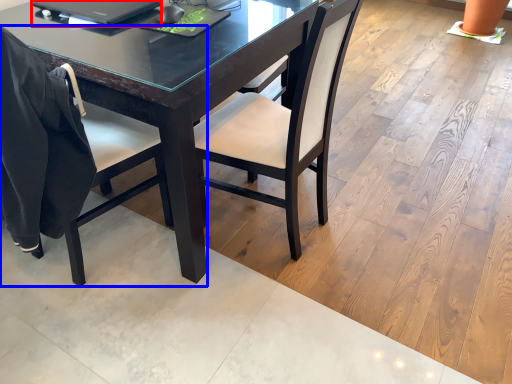
Question: Which object is closer to the camera taking this photo, laptop (highlighted by a red box) or chair (highlighted by a blue box)?

Choices:
 (A) laptop
 (B) chair

Answer: (B)